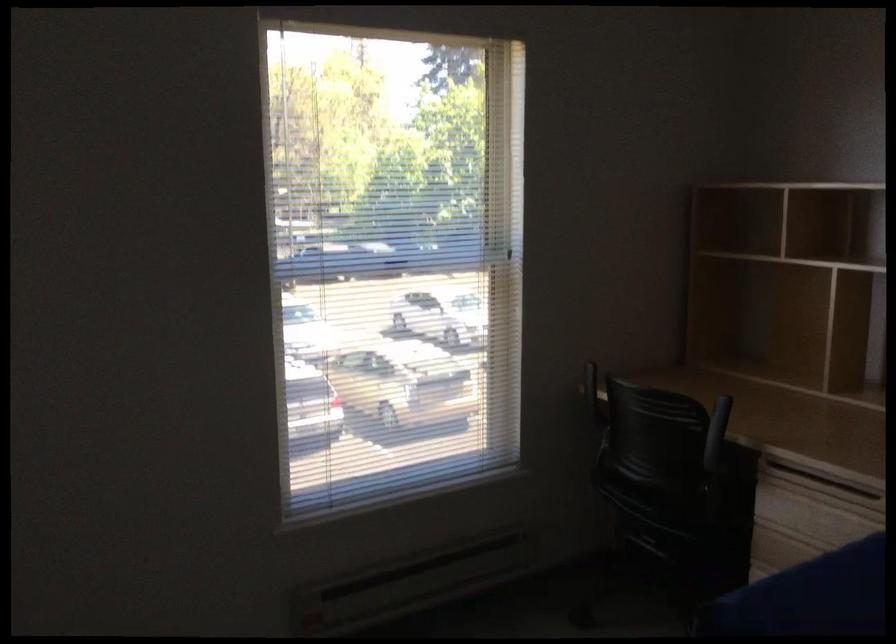
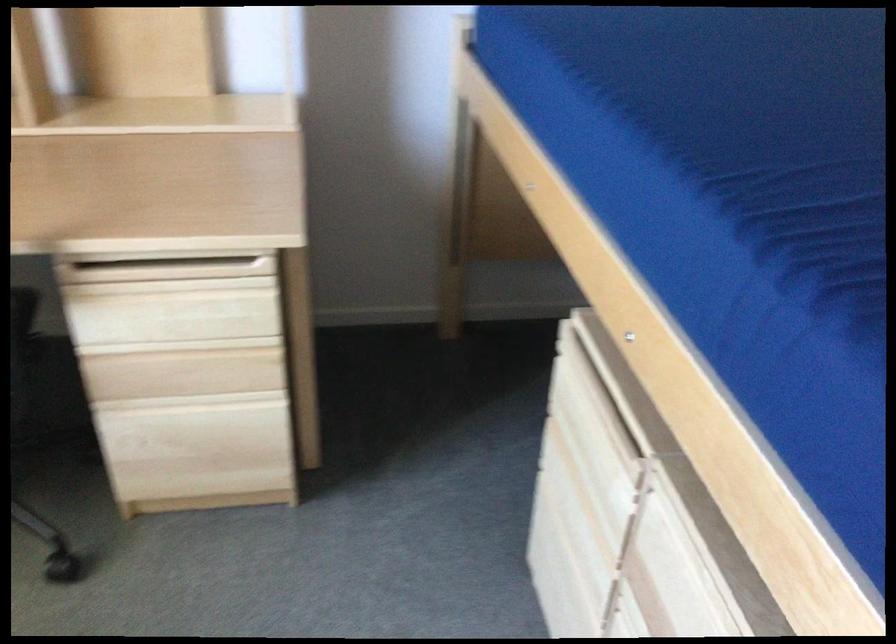
Where in the second image is the point corresponding to point (821, 495) from the first image?

(166, 270)